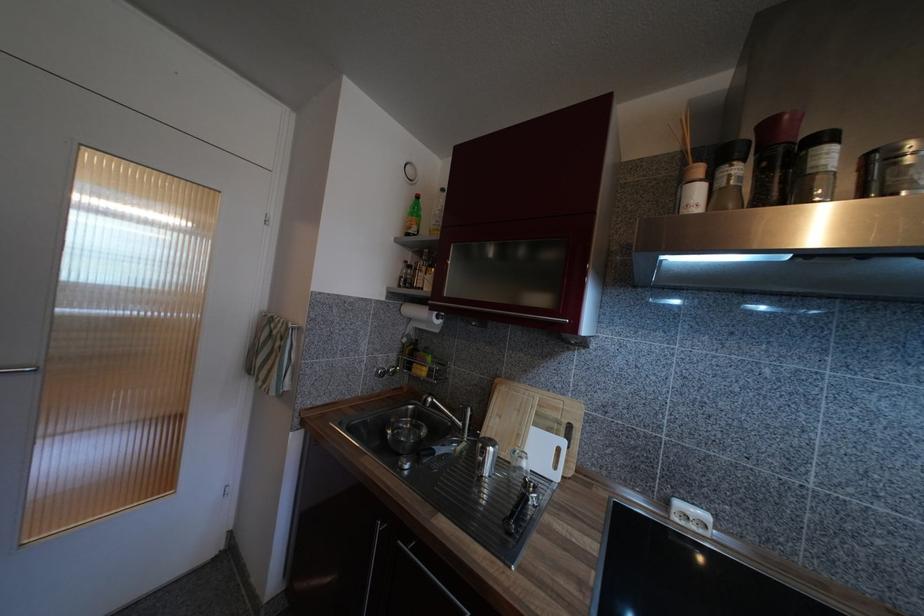
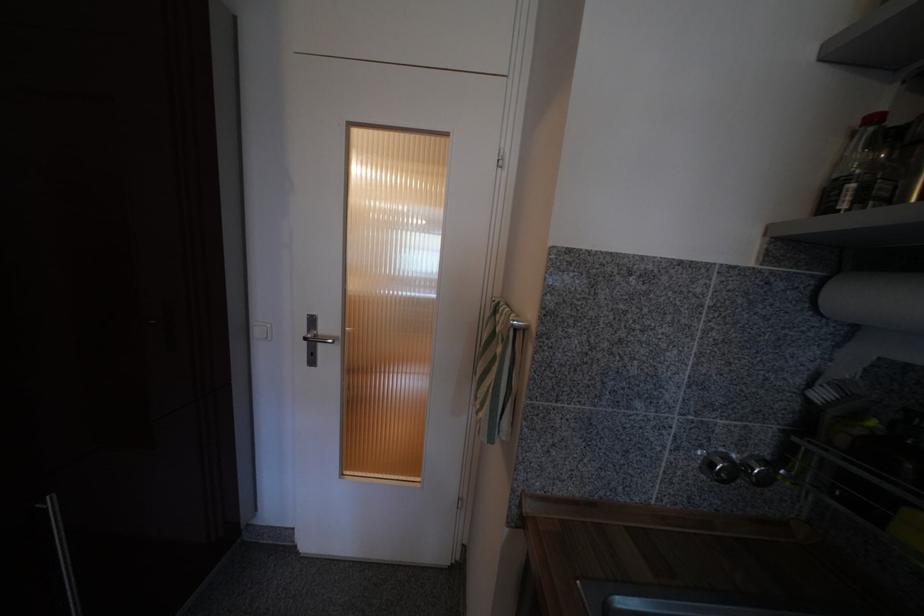
Find the pixel in the second image that matches pixel 398 374 in the first image.

(772, 482)